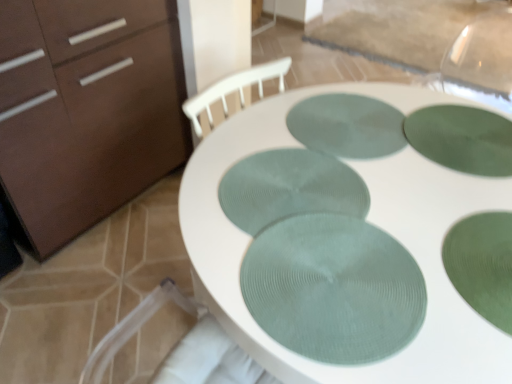
Identify the location of free space to the left of green textured glass plate at upper right, placed as the 2th glass plate when sorted from back to front. (351, 144).